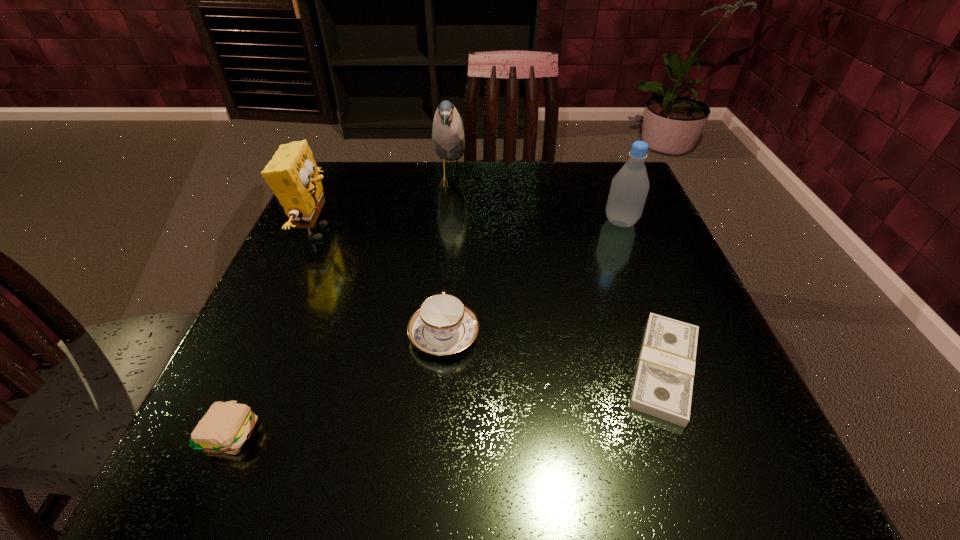
Locate an element on the screen. free location at the far right corner of the desktop is located at coordinates (588, 196).

This screenshot has height=540, width=960. Find the location of `free space at the near right corner`. free space at the near right corner is located at coordinates (648, 443).

Where is `free space between the dollar and the fourth tallest object`? The image size is (960, 540). free space between the dollar and the fourth tallest object is located at coordinates (554, 352).

At what (x,y) coordinates should I click in order to perform the action: click on free space between the sponge and the dollar. Please return your answer as a coordinate pair (x, y). This screenshot has height=540, width=960. Looking at the image, I should click on (491, 300).

In order to click on free point between the bird and the teacup in this screenshot , I will do pos(447,258).

The image size is (960, 540). I want to click on free space that is in between the bird and the patty, so click(x=341, y=307).

You are a GUI agent. You are given a task and a screenshot of the screen. Output one action in this format:
    pyautogui.click(x=<x>, y=<y>)
    Task: Click on the unoccupied position between the bottle and the farthest object
    This screenshot has width=960, height=540.
    Given the screenshot: What is the action you would take?
    pyautogui.click(x=536, y=201)

At what (x,y) coordinates should I click in order to perform the action: click on free space between the patty and the sponge. Please return your answer as a coordinate pair (x, y). The height and width of the screenshot is (540, 960). Looking at the image, I should click on (274, 333).

This screenshot has width=960, height=540. I want to click on vacant area that lies between the bird and the fourth tallest object, so click(x=447, y=258).

At what (x,y) coordinates should I click in order to perform the action: click on vacant space that is in between the bottle and the farthest object. Please return your answer as a coordinate pair (x, y). Looking at the image, I should click on (536, 201).